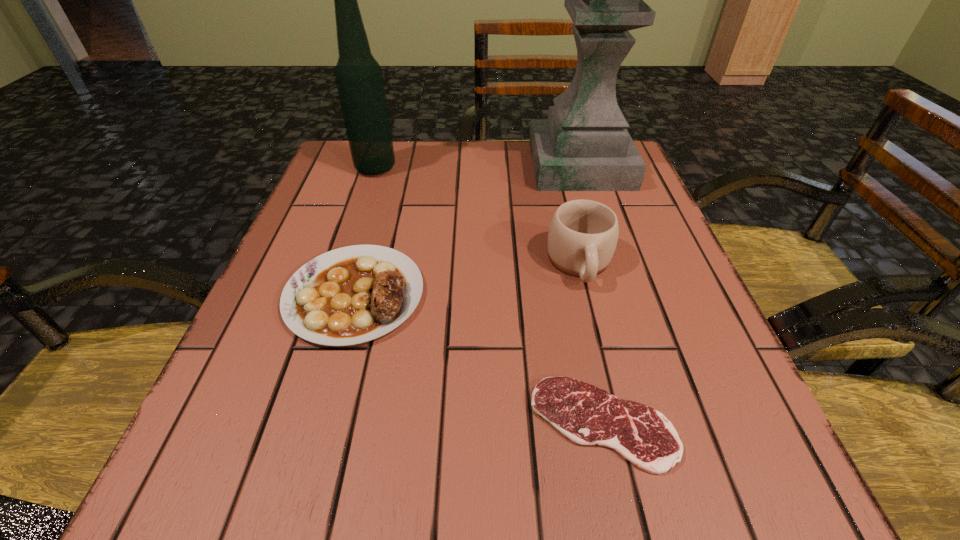
This screenshot has width=960, height=540. What are the coordinates of `vacant space situated 0.110m on the right of the alcohol` in the screenshot? It's located at (442, 168).

Locate an element on the screen. free spot located on the side of the mug with the handle is located at coordinates (629, 467).

I want to click on free space located on the right of the left steak, so click(481, 294).

The image size is (960, 540). Identify the location of free space located on the back of the nearer steak. (567, 257).

The image size is (960, 540). I want to click on sculpture at the far edge, so click(x=584, y=145).

The width and height of the screenshot is (960, 540). In order to click on alcohol that is positioned at the far edge in this screenshot , I will do `click(359, 79)`.

Locate an element on the screen. Image resolution: width=960 pixels, height=540 pixels. object at the near edge is located at coordinates (587, 415).

The width and height of the screenshot is (960, 540). In order to click on alcohol located in the left edge section of the desktop in this screenshot , I will do `click(359, 79)`.

This screenshot has height=540, width=960. I want to click on steak located in the left edge section of the desktop, so (x=354, y=294).

This screenshot has width=960, height=540. What are the coordinates of `sculpture at the right edge` in the screenshot? It's located at (584, 145).